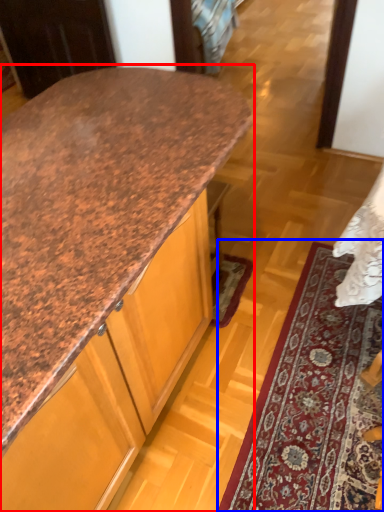
Question: Which object appears farthest to the camera in this image, countertop (highlighted by a red box) or mat (highlighted by a blue box)?

Choices:
 (A) countertop
 (B) mat

Answer: (B)